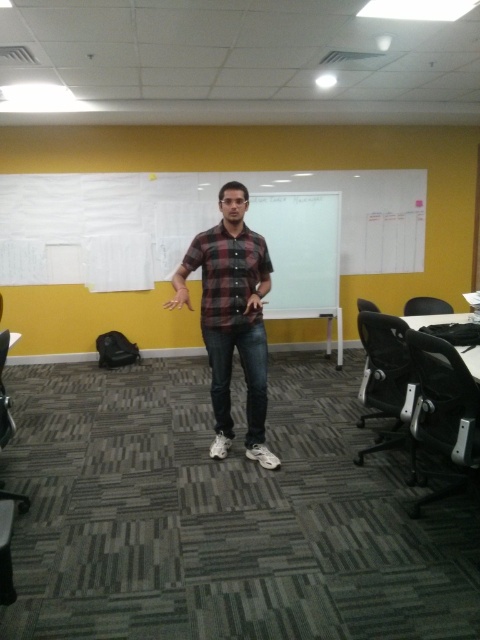
From the picture: You are standing at point (231, 317) in the image. What object is located at this point?

The plaid shirt at center is located at point (231, 317).

You are organizing a clothing donation drive and need to sort items by size. You have two shirts in front of you labeled as plaid shirt at center and plaid cotton shirt at center. Which shirt should you place in the large size bin?

The plaid shirt at center should be placed in the large size bin because its width is larger than that of the plaid cotton shirt at center.